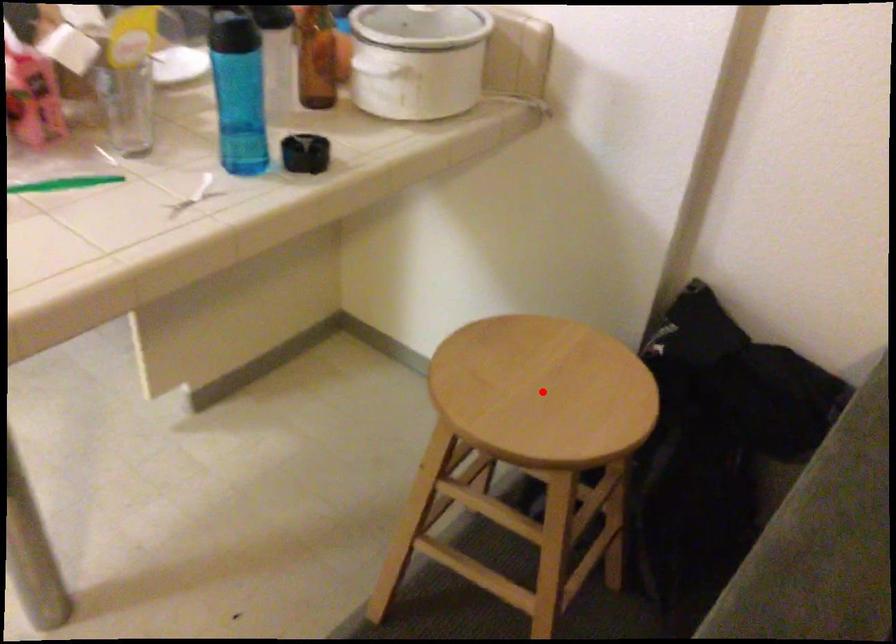
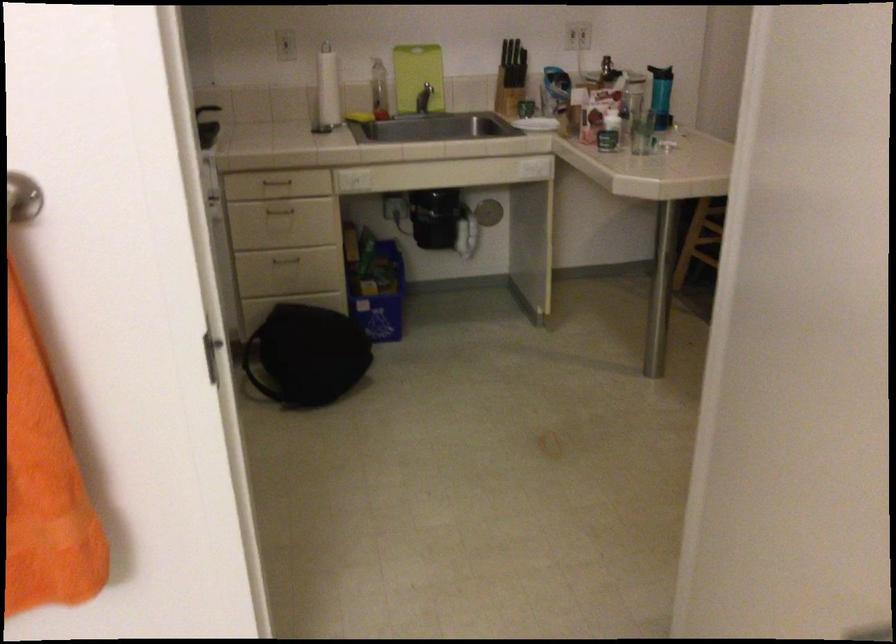
Question: I am providing you with two images of the same scene from different viewpoints. A red point is marked on the first image. Is the red point's position out of view in image 2?

Choices:
 (A) Yes
 (B) No

Answer: (A)